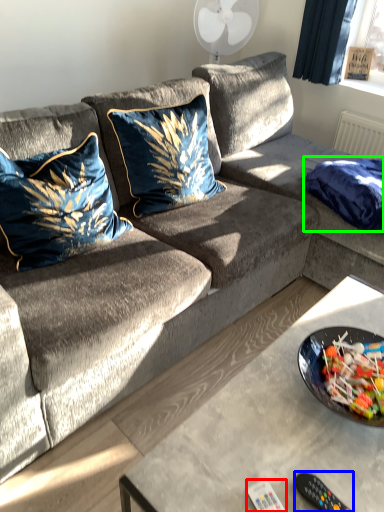
Question: Estimate the real-world distances between objects in this image. Which object is farther from remote (highlighted by a red box), remote control (highlighted by a blue box) or blanket (highlighted by a green box)?

Choices:
 (A) remote control
 (B) blanket

Answer: (B)